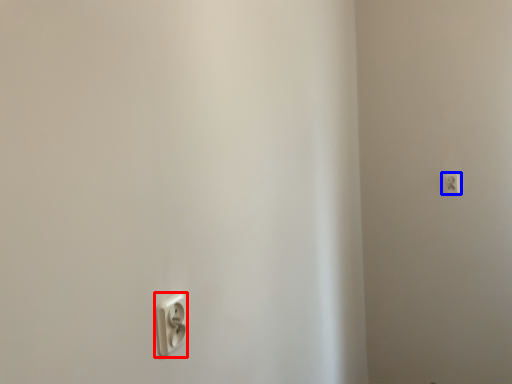
Question: Which point is closer to the camera, power plugs and sockets (highlighted by a red box) or power plugs and sockets (highlighted by a blue box)?

Choices:
 (A) power plugs and sockets
 (B) power plugs and sockets

Answer: (A)